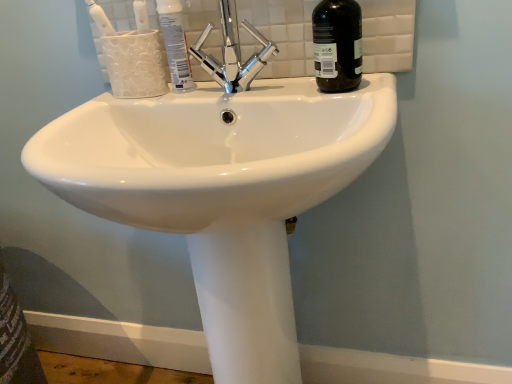
Question: From a real-world perspective, is white glossy sink at center physically located above or below black glass bottle at upper right?

Choices:
 (A) below
 (B) above

Answer: (A)

Question: Is white glossy sink at center taller or shorter than black glass bottle at upper right?

Choices:
 (A) tall
 (B) short

Answer: (A)

Question: Which object is the farthest from the black glass bottle at upper right?

Choices:
 (A) polished chrome faucet at upper center
 (B) white glossy toothpaste at upper center
 (C) white glossy sink at center
 (D) white glossy toothbrush at upper left

Answer: (D)

Question: Which is nearer to the white glossy sink at center?

Choices:
 (A) white glossy toothpaste at upper center
 (B) black glass bottle at upper right
 (C) polished chrome faucet at upper center
 (D) white glossy toothbrush at upper left

Answer: (C)